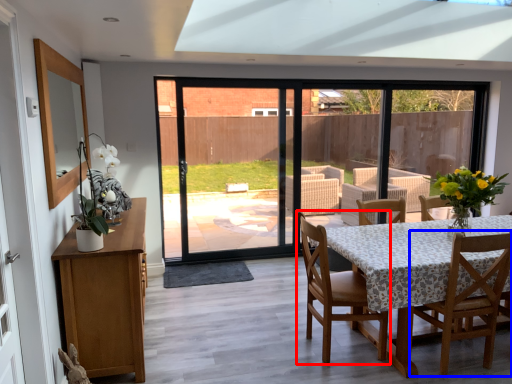
Question: Which object appears farthest to the camera in this image, chair (highlighted by a red box) or chair (highlighted by a blue box)?

Choices:
 (A) chair
 (B) chair

Answer: (A)